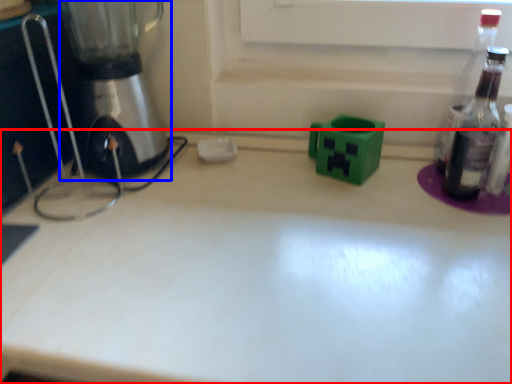
Question: Among these objects, which one is nearest to the camera, countertop (highlighted by a red box) or mixer (highlighted by a blue box)?

Choices:
 (A) countertop
 (B) mixer

Answer: (A)